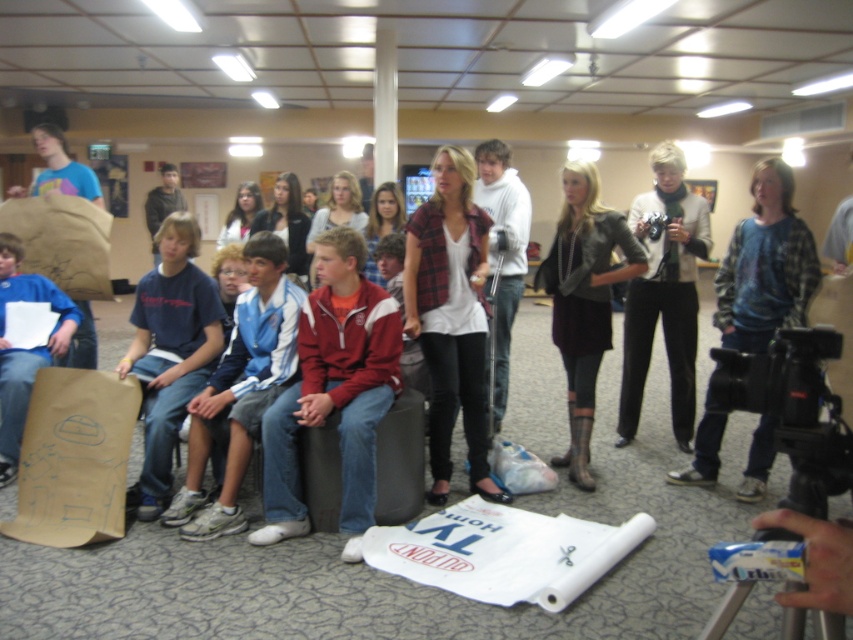
Can you confirm if red jacket at center is wider than blue athletic wear at center?

Yes, red jacket at center is wider than blue athletic wear at center.

Which of these two, red jacket at center or blue athletic wear at center, stands shorter?

blue athletic wear at center is shorter.

What do you see at coordinates (334, 392) in the screenshot? Image resolution: width=853 pixels, height=640 pixels. I see `red jacket at center` at bounding box center [334, 392].

The image size is (853, 640). What are the coordinates of `red jacket at center` in the screenshot? It's located at (334, 392).

This screenshot has height=640, width=853. Find the location of `red jacket at center`. red jacket at center is located at coordinates (334, 392).

Is point (305, 355) less distant than point (181, 307)?

Yes, it is.

This screenshot has height=640, width=853. Identify the location of red jacket at center. (334, 392).

Between plaid flannel shirt at center and blue athletic wear at center, which one has more height?

With more height is plaid flannel shirt at center.

Is plaid flannel shirt at center further to the viewer compared to blue athletic wear at center?

Yes.

Find the location of a particular element. The width and height of the screenshot is (853, 640). plaid flannel shirt at center is located at coordinates (451, 317).